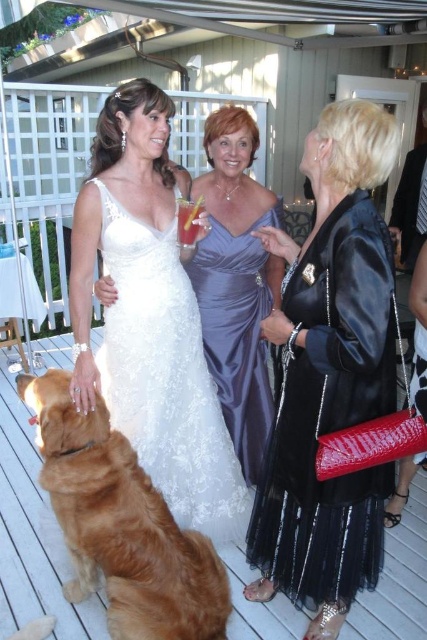
In the scene shown: You are standing at the center of the scene and want to walk towards the point that is closer to you. Which point should you head towards, point (187, 604) or point (260, 360)?

Point (187, 604) is in front of point (260, 360), so you should head towards point (187, 604) since it is closer to you.

You are a photographer at the wedding reception. You want to take a photo of the white lace dress at center without the translucent glass at center appearing in the shot. Is it possible to do so?

The white lace dress at center is positioned under the translucent glass at center, so the glass is above the dress. Since the glass is translucent, it might still cast a slight haze or reflection, but if you adjust the angle or use a lens hood to block any reflections, you could potentially capture the dress without the glass being prominently visible. However, complete elimination might be challenging depending on the glass material and lighting conditions.